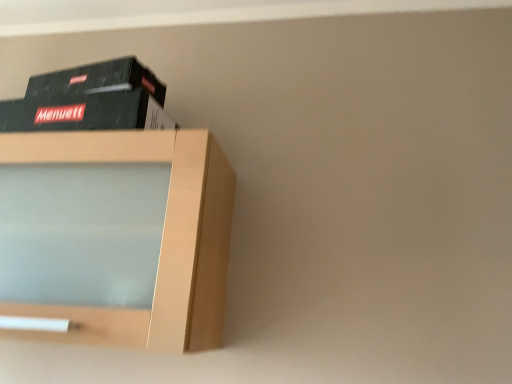
Question: Is black matte book at upper left inside the boundaries of light wood shelf at upper left, or outside?

Choices:
 (A) inside
 (B) outside

Answer: (B)

Question: Is black matte book at upper left taller or shorter than light wood shelf at upper left?

Choices:
 (A) short
 (B) tall

Answer: (A)

Question: Is black matte book at upper left wider or thinner than light wood shelf at upper left?

Choices:
 (A) wide
 (B) thin

Answer: (B)

Question: Is light wood shelf at upper left taller or shorter than black matte book at upper left?

Choices:
 (A) tall
 (B) short

Answer: (A)

Question: Relative to black matte book at upper left, is light wood shelf at upper left in front or behind?

Choices:
 (A) front
 (B) behind

Answer: (A)

Question: Is light wood shelf at upper left to the left or to the right of black matte book at upper left in the image?

Choices:
 (A) left
 (B) right

Answer: (A)

Question: Does point (33, 299) appear closer or farther from the camera than point (5, 129)?

Choices:
 (A) farther
 (B) closer

Answer: (B)